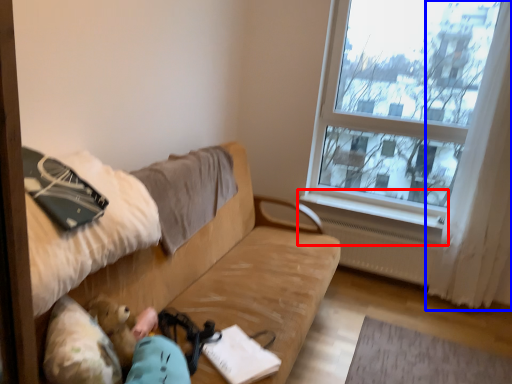
Question: Which object appears farthest to the camera in this image, window sill (highlighted by a red box) or curtain (highlighted by a blue box)?

Choices:
 (A) window sill
 (B) curtain

Answer: (A)